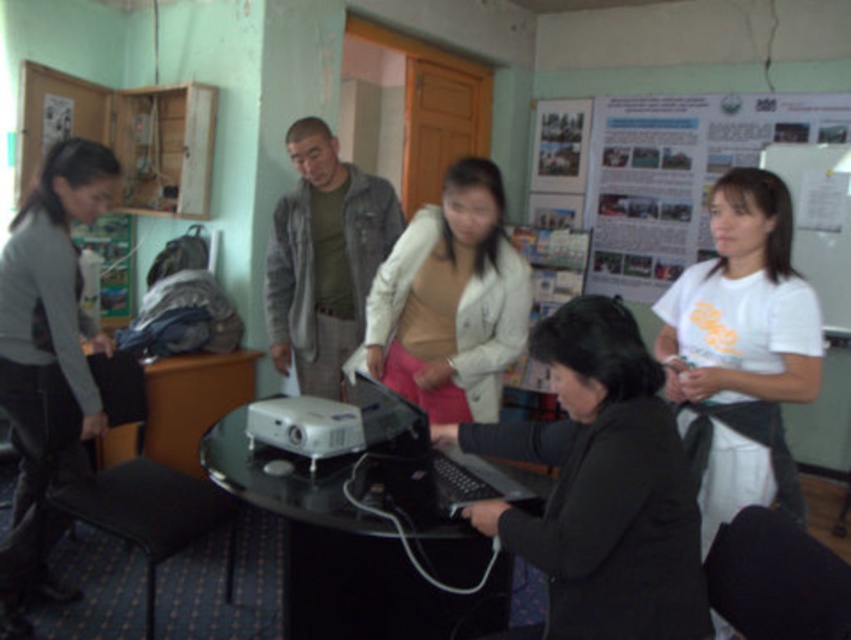
Question: Can you confirm if black glass table at center is positioned above gray sweater at left?

Choices:
 (A) yes
 (B) no

Answer: (B)

Question: Is black matte jacket at lower center thinner than white textured jacket at center?

Choices:
 (A) yes
 (B) no

Answer: (A)

Question: Is black glass table at center positioned before black plastic laptop at center?

Choices:
 (A) yes
 (B) no

Answer: (A)

Question: Estimate the real-world distances between objects in this image. Which object is farther from the white matte shirt at center?

Choices:
 (A) black glass table at center
 (B) white textured jacket at center
 (C) black matte jacket at lower center

Answer: (A)

Question: Which of the following is the closest to the observer?

Choices:
 (A) gray sweater at left
 (B) white textured jacket at center
 (C) black glass table at center
 (D) black plastic laptop at center

Answer: (C)

Question: Which object is positioned farthest from the black glass table at center?

Choices:
 (A) black matte jacket at lower center
 (B) white matte shirt at center
 (C) black plastic laptop at center
 (D) gray sweater at left

Answer: (D)